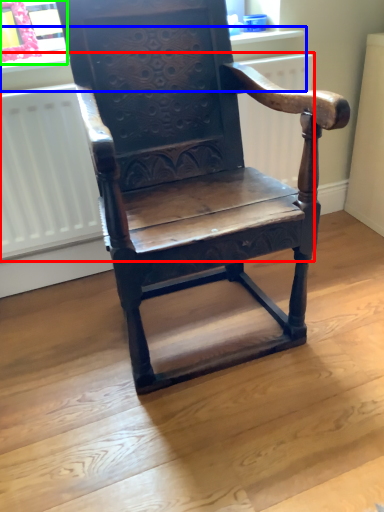
Question: Estimate the real-world distances between objects in this image. Which object is closer to radiator (highlighted by a red box), window sill (highlighted by a blue box) or window frame (highlighted by a green box)?

Choices:
 (A) window sill
 (B) window frame

Answer: (A)